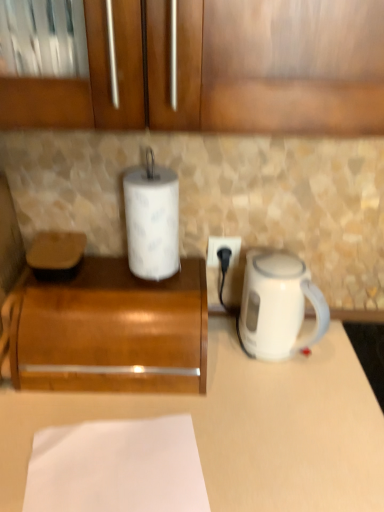
Question: Based on their sizes in the image, would you say white glossy electric kettle at right is bigger or smaller than white paper at center?

Choices:
 (A) big
 (B) small

Answer: (A)

Question: Is white glossy electric kettle at right inside or outside of white paper at center?

Choices:
 (A) outside
 (B) inside

Answer: (A)

Question: Which is nearer to the white paper at lower center?

Choices:
 (A) white paper at center
 (B) wooden at left
 (C) white matte counter at center
 (D) white glossy electric kettle at right
 (E) white plastic power outlet at center

Answer: (C)

Question: Considering the real-world distances, which object is closest to the wooden at left?

Choices:
 (A) white paper at center
 (B) white matte counter at center
 (C) white paper at lower center
 (D) white glossy electric kettle at right
 (E) white plastic power outlet at center

Answer: (B)